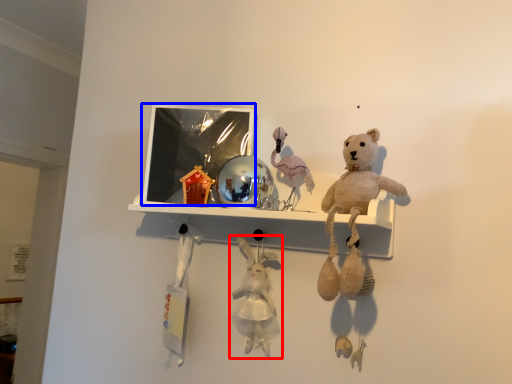
Question: Which point is further to the camera, toy (highlighted by a red box) or picture frame (highlighted by a blue box)?

Choices:
 (A) toy
 (B) picture frame

Answer: (B)